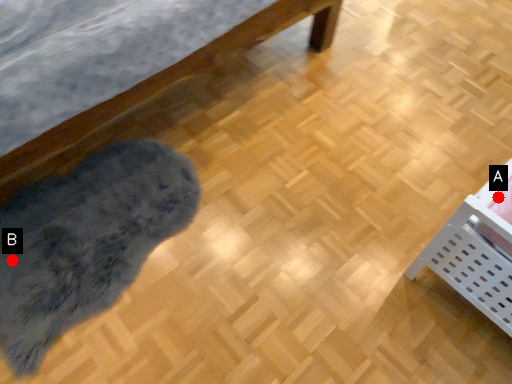
Question: Two points are circled on the image, labeled by A and B beside each circle. Which of the following is the farthest from the observer?

Choices:
 (A) A is further
 (B) B is further

Answer: (B)